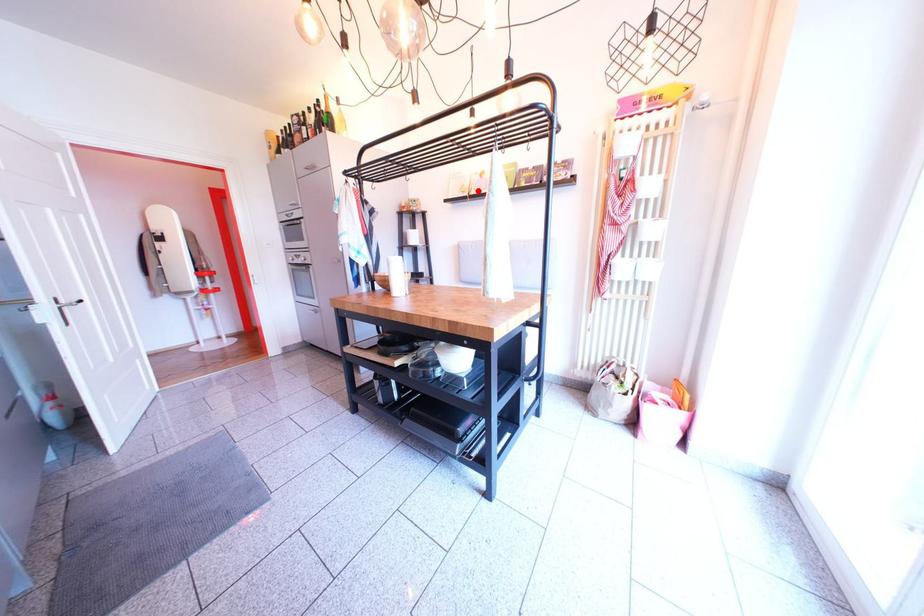
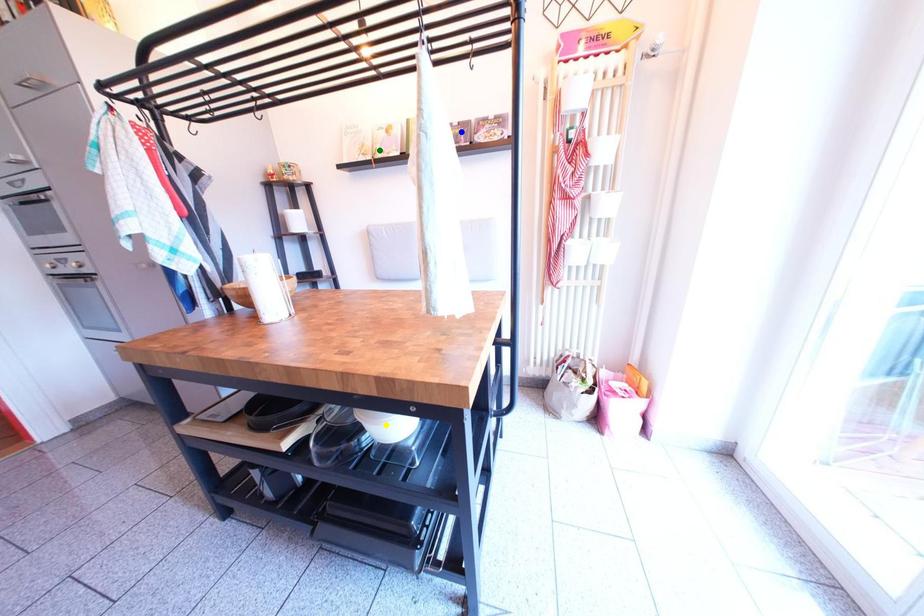
Question: I am providing you with two images of the same scene from different viewpoints. A red point is marked on the first image. You are given multiple points on the second image. Which mark in image 2 goes with the point in image 1?

Choices:
 (A) blue point
 (B) green point
 (C) yellow point

Answer: (B)